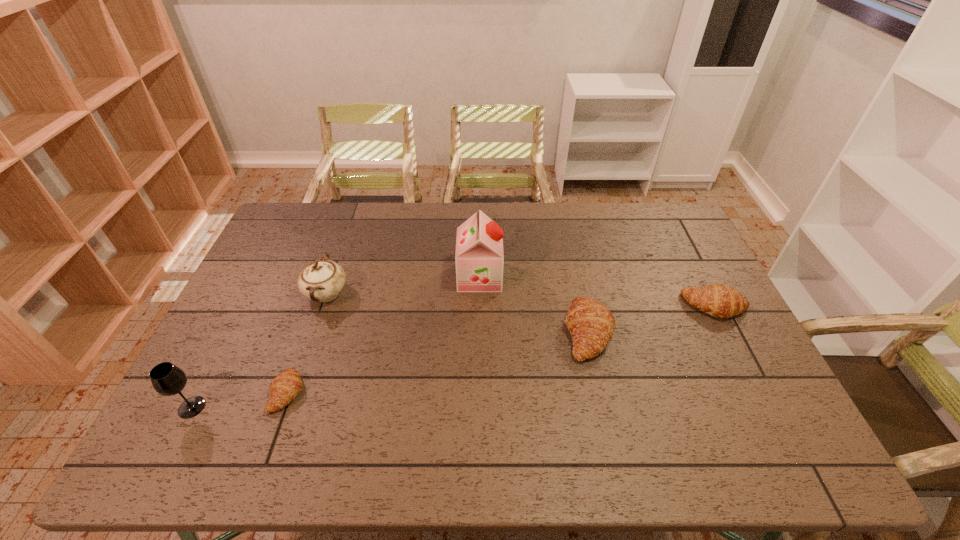
I want to click on vacant area situated on the right of the second object from right to left, so click(x=685, y=332).

Locate an element on the screen. The height and width of the screenshot is (540, 960). vacant area located on the front of the second tallest crescent roll is located at coordinates (743, 361).

Locate an element on the screen. free spot located 0.190m on the back of the chinaware is located at coordinates (346, 237).

The width and height of the screenshot is (960, 540). In order to click on vacant space situated 0.110m with the cap open on the third object from right to left in this screenshot , I will do `click(535, 276)`.

Image resolution: width=960 pixels, height=540 pixels. I want to click on free space located 0.300m on the back of the wineglass, so click(243, 308).

Locate an element on the screen. This screenshot has height=540, width=960. crescent roll that is at the near edge is located at coordinates (287, 385).

Identify the location of wineglass that is at the near edge. This screenshot has width=960, height=540. (167, 379).

The height and width of the screenshot is (540, 960). I want to click on object present at the left edge, so click(x=167, y=379).

Locate an element on the screen. object at the right edge is located at coordinates (720, 301).

Locate an element on the screen. The image size is (960, 540). object at the near left corner is located at coordinates (167, 379).